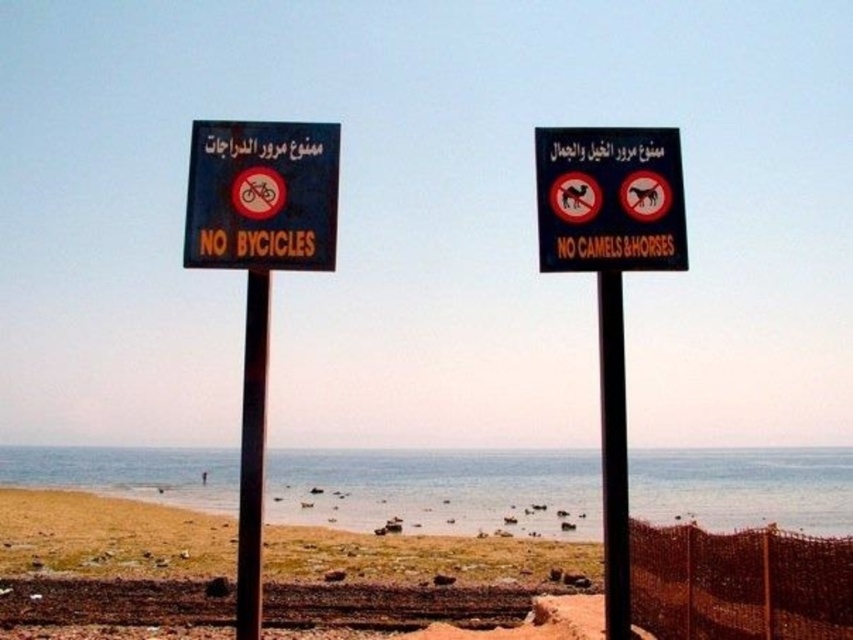
Is black plastic signboard at left positioned at the back of black metal pole at center?

Yes.

Which is more to the left, black plastic signboard at left or black metal pole at center?

From the viewer's perspective, black plastic signboard at left appears more on the left side.

Between point (250, 172) and point (601, 344), which one is positioned behind?

The point (601, 344) is behind.

Image resolution: width=853 pixels, height=640 pixels. I want to click on black plastic signboard at left, so pyautogui.click(x=260, y=195).

Is black plastic signboard at left to the left of black plastic sign at center from the viewer's perspective?

Yes, black plastic signboard at left is to the left of black plastic sign at center.

Between point (219, 221) and point (625, 260), which one is positioned behind?

The point (625, 260) is behind.

Between point (253, 241) and point (602, 138), which one is positioned behind?

Point (602, 138)

Where is `black plastic signboard at left`? The image size is (853, 640). black plastic signboard at left is located at coordinates (260, 195).

Does point (260, 163) come closer to viewer compared to point (236, 588)?

No.

Who is positioned more to the right, black plastic signboard at left or metallic pole at center?

Positioned to the right is black plastic signboard at left.

At what (x,y) coordinates should I click in order to perform the action: click on black plastic signboard at left. Please return your answer as a coordinate pair (x, y). The height and width of the screenshot is (640, 853). Looking at the image, I should click on (260, 195).

This screenshot has height=640, width=853. I want to click on black plastic signboard at left, so (260, 195).